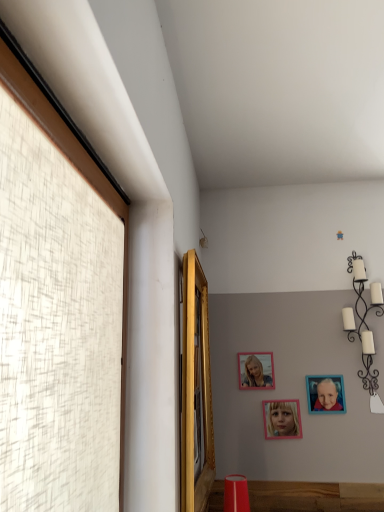
The image size is (384, 512). Find the location of `matte white lampshade at upper center, which ranks as the second lamp in right-to-left order`. matte white lampshade at upper center, which ranks as the second lamp in right-to-left order is located at coordinates (203, 240).

Image resolution: width=384 pixels, height=512 pixels. Describe the element at coordinates (281, 419) in the screenshot. I see `pink matte picture frame at center, acting as the 2th picture frame starting from the left` at that location.

What do you see at coordinates (366, 328) in the screenshot? The height and width of the screenshot is (512, 384). I see `white matte candle holder at upper right, the second lamp from the top` at bounding box center [366, 328].

Find the location of a particular element. matte white lampshade at upper center, arranged as the 1th lamp when viewed from the left is located at coordinates (203, 240).

From the image's perspective, would you say pink matte picture frame at center, arranged as the 2th picture frame when viewed from the right, is positioned over white textured window at left, the first window positioned from the front?

No, from the image's perspective, pink matte picture frame at center, arranged as the 2th picture frame when viewed from the right, is not over white textured window at left, the first window positioned from the front.

Where is `the 2nd window to the left of the pink matte picture frame at center, acting as the 2th picture frame starting from the left, starting your count from the anchor`? the 2nd window to the left of the pink matte picture frame at center, acting as the 2th picture frame starting from the left, starting your count from the anchor is located at coordinates (74, 164).

Is point (270, 404) positioned in front of point (54, 105)?

No, it is not.

Is pink matte picture frame at center, arranged as the 2th picture frame when viewed from the right, not close to white textured window at left, acting as the 2th window starting from the right?

Indeed, pink matte picture frame at center, arranged as the 2th picture frame when viewed from the right, is not near white textured window at left, acting as the 2th window starting from the right.

How different are the orientations of gold wooden mirror at upper left, which is the first window in back-to-front order, and matte white lampshade at upper center, which ranks as the 2th lamp in bottom-to-top order, in degrees?

The angular difference between gold wooden mirror at upper left, which is the first window in back-to-front order, and matte white lampshade at upper center, which ranks as the 2th lamp in bottom-to-top order, is 0.000903 degrees.

Does gold wooden mirror at upper left, which is the first window in back-to-front order, have a larger size compared to matte white lampshade at upper center, the 1th lamp when ordered from back to front?

Indeed, gold wooden mirror at upper left, which is the first window in back-to-front order, has a larger size compared to matte white lampshade at upper center, the 1th lamp when ordered from back to front.

From the image's perspective, is gold wooden mirror at upper left, which is the first window in back-to-front order, located beneath matte white lampshade at upper center, arranged as the 1th lamp when viewed from the left?

Yes, from the image's perspective, gold wooden mirror at upper left, which is the first window in back-to-front order, is below matte white lampshade at upper center, arranged as the 1th lamp when viewed from the left.

From a real-world perspective, is gold wooden mirror at upper left, which is the first window in back-to-front order, positioned above or below matte white lampshade at upper center, the first lamp when ordered from top to bottom?

In terms of real-world spatial position, gold wooden mirror at upper left, which is the first window in back-to-front order, is below matte white lampshade at upper center, the first lamp when ordered from top to bottom.

Is gold wooden mirror at upper left, which is the first window in back-to-front order, not close to white matte candle holder at upper right, acting as the first lamp starting from the right?

Yes, gold wooden mirror at upper left, which is the first window in back-to-front order, and white matte candle holder at upper right, acting as the first lamp starting from the right, are quite far apart.

Between gold wooden mirror at upper left, which is the first window in back-to-front order, and white matte candle holder at upper right, the 2th lamp in the back-to-front sequence, which one is positioned behind?

white matte candle holder at upper right, the 2th lamp in the back-to-front sequence, is more distant.

From a real-world perspective, is gold wooden mirror at upper left, the 2th window positioned from the left, physically located above or below white matte candle holder at upper right, the second lamp from the top?

In terms of real-world spatial position, gold wooden mirror at upper left, the 2th window positioned from the left, is below white matte candle holder at upper right, the second lamp from the top.

Would you say pink matte picture frame at center, acting as the 2th picture frame starting from the left, contains matte white lampshade at upper center, the first lamp when ordered from top to bottom?

No, matte white lampshade at upper center, the first lamp when ordered from top to bottom, is located outside of pink matte picture frame at center, acting as the 2th picture frame starting from the left.

From a real-world perspective, is pink matte picture frame at center, acting as the 2th picture frame starting from the left, on matte white lampshade at upper center, which ranks as the second lamp in right-to-left order?

No, from a real-world perspective, pink matte picture frame at center, acting as the 2th picture frame starting from the left, is not over matte white lampshade at upper center, which ranks as the second lamp in right-to-left order

Is pink matte picture frame at center, acting as the 2th picture frame starting from the left, oriented towards matte white lampshade at upper center, which ranks as the 2th lamp in bottom-to-top order?

No, pink matte picture frame at center, acting as the 2th picture frame starting from the left, is not oriented towards matte white lampshade at upper center, which ranks as the 2th lamp in bottom-to-top order.

From the image's perspective, starting from the white matte candle holder at upper right, which is the 1th lamp from bottom to top, which picture frame is the 1st one below? Please provide its 2D coordinates.

[(256, 371)]

Is white matte candle holder at upper right, the second lamp from the top, far from pink matte picture frame at upper center, the 3th picture frame viewed from the right?

No.

Consider the image. Considering their positions, is white matte candle holder at upper right, the second lamp viewed from the left, located in front of or behind pink matte picture frame at upper center, the 3th picture frame viewed from the right?

white matte candle holder at upper right, the second lamp viewed from the left, is positioned closer to the viewer than pink matte picture frame at upper center, the 3th picture frame viewed from the right.

Is pink matte picture frame at upper center, which is counted as the 1th picture frame, starting from the left, located within white matte candle holder at upper right, which is the 1th lamp from bottom to top?

No.

Consider the image. Is pink matte picture frame at center, acting as the 2th picture frame starting from the left, positioned beyond the bounds of pink matte picture frame at upper center, which is counted as the 1th picture frame, starting from the left?

Yes, pink matte picture frame at center, acting as the 2th picture frame starting from the left, is outside of pink matte picture frame at upper center, which is counted as the 1th picture frame, starting from the left.

From a real-world perspective, relative to pink matte picture frame at upper center, the 3th picture frame viewed from the right, is pink matte picture frame at center, arranged as the 2th picture frame when viewed from the right, vertically above or below?

In terms of real-world spatial position, pink matte picture frame at center, arranged as the 2th picture frame when viewed from the right, is below pink matte picture frame at upper center, the 3th picture frame viewed from the right.

Could you tell me if pink matte picture frame at center, acting as the 2th picture frame starting from the left, is turned towards pink matte picture frame at upper center, the 3th picture frame viewed from the right?

No, pink matte picture frame at center, acting as the 2th picture frame starting from the left, does not turn towards pink matte picture frame at upper center, the 3th picture frame viewed from the right.

Based on the photo, considering the relative sizes of pink matte picture frame at center, acting as the 2th picture frame starting from the left, and pink matte picture frame at upper center, which is counted as the 1th picture frame, starting from the left, in the image provided, is pink matte picture frame at center, acting as the 2th picture frame starting from the left, smaller than pink matte picture frame at upper center, which is counted as the 1th picture frame, starting from the left,?

Yes, pink matte picture frame at center, acting as the 2th picture frame starting from the left, is smaller than pink matte picture frame at upper center, which is counted as the 1th picture frame, starting from the left.

Is white textured window at left, marked as the 1th window in a left-to-right arrangement, oriented towards gold wooden mirror at upper left, which is the first window in back-to-front order?

No, white textured window at left, marked as the 1th window in a left-to-right arrangement, is not turned towards gold wooden mirror at upper left, which is the first window in back-to-front order.

How far apart are white textured window at left, marked as the 1th window in a left-to-right arrangement, and gold wooden mirror at upper left, the 2th window positioned from the left?

white textured window at left, marked as the 1th window in a left-to-right arrangement, and gold wooden mirror at upper left, the 2th window positioned from the left, are 16.38 inches apart from each other.

Does white textured window at left, the 2th window from the back, touch gold wooden mirror at upper left, which is the first window in back-to-front order?

No, white textured window at left, the 2th window from the back, is not with gold wooden mirror at upper left, which is the first window in back-to-front order.

Is white textured window at left, the first window positioned from the front, taller or shorter than gold wooden mirror at upper left, which is the first window in back-to-front order?

Clearly, white textured window at left, the first window positioned from the front, is taller compared to gold wooden mirror at upper left, which is the first window in back-to-front order.

Locate an element on the screen. Image resolution: width=384 pixels, height=512 pixels. the 2nd window positioned above the pink matte picture frame at center, acting as the 2th picture frame starting from the left (from the image's perspective) is located at coordinates (74, 164).

At what (x,y) coordinates should I click in order to perform the action: click on lamp that is the 2nd object located behind the gold wooden mirror at upper left, the 2th window positioned from the left. Please return your answer as a coordinate pair (x, y). Image resolution: width=384 pixels, height=512 pixels. Looking at the image, I should click on (203, 240).

From the image, which object appears to be nearer to blue matte picture frame at upper right, marked as the 1th picture frame in a right-to-left arrangement, white textured window at left, the first window positioned from the front, or white matte candle holder at upper right, the 1th lamp when ordered from front to back?

The object closer to blue matte picture frame at upper right, marked as the 1th picture frame in a right-to-left arrangement, is white matte candle holder at upper right, the 1th lamp when ordered from front to back.

Considering their positions, is matte white lampshade at upper center, the first lamp when ordered from top to bottom, positioned closer to pink matte picture frame at upper center, which is counted as the 1th picture frame, starting from the left, than white textured window at left, the 2th window from the back?

Among the two, matte white lampshade at upper center, the first lamp when ordered from top to bottom, is located nearer to pink matte picture frame at upper center, which is counted as the 1th picture frame, starting from the left.

From the image, which object appears to be nearer to gold wooden mirror at upper left, which ranks as the first window in right-to-left order, white textured window at left, acting as the 2th window starting from the right, or white matte candle holder at upper right, the second lamp viewed from the left?

Among the two, white textured window at left, acting as the 2th window starting from the right, is located nearer to gold wooden mirror at upper left, which ranks as the first window in right-to-left order.

Considering their positions, is pink matte picture frame at center, acting as the 2th picture frame starting from the left, positioned closer to blue matte picture frame at upper right, the 3th picture frame from the left, than pink matte picture frame at upper center, the 3th picture frame viewed from the right?

pink matte picture frame at center, acting as the 2th picture frame starting from the left.

Estimate the real-world distances between objects in this image. Which object is further from white matte candle holder at upper right, the 1th lamp when ordered from front to back, pink matte picture frame at upper center, which is counted as the 1th picture frame, starting from the left, or gold wooden mirror at upper left, the 2th window positioned from the left?

gold wooden mirror at upper left, the 2th window positioned from the left.

Based on their spatial positions, is white matte candle holder at upper right, the second lamp from the top, or pink matte picture frame at center, acting as the 2th picture frame starting from the left, further from pink matte picture frame at upper center, the 3th picture frame viewed from the right?

white matte candle holder at upper right, the second lamp from the top.

From the image, which object appears to be farther from matte white lampshade at upper center, the 2th lamp positioned from the front, white matte candle holder at upper right, the second lamp viewed from the left, or white textured window at left, the first window positioned from the front?

white textured window at left, the first window positioned from the front, lies further to matte white lampshade at upper center, the 2th lamp positioned from the front, than the other object.

When comparing their distances from white textured window at left, marked as the 1th window in a left-to-right arrangement, does white matte candle holder at upper right, the second lamp from the top, or blue matte picture frame at upper right, the 3th picture frame from the left, seem further?

white matte candle holder at upper right, the second lamp from the top, is further to white textured window at left, marked as the 1th window in a left-to-right arrangement.

At what (x,y) coordinates should I click in order to perform the action: click on lamp between white textured window at left, marked as the 1th window in a left-to-right arrangement, and blue matte picture frame at upper right, the 3th picture frame from the left, in the front-back direction. Please return your answer as a coordinate pair (x, y). This screenshot has width=384, height=512. Looking at the image, I should click on (366, 328).

Identify the location of picture frame between pink matte picture frame at upper center, which is counted as the 1th picture frame, starting from the left, and blue matte picture frame at upper right, the 3th picture frame from the left, from left to right. The width and height of the screenshot is (384, 512). (281, 419).

Identify the location of lamp between white textured window at left, the first window positioned from the front, and pink matte picture frame at upper center, the 3th picture frame viewed from the right, in the front-back direction. This screenshot has width=384, height=512. (366, 328).

Identify the location of window located between white textured window at left, marked as the 1th window in a left-to-right arrangement, and white matte candle holder at upper right, the second lamp from the top, in the depth direction. The image size is (384, 512). (196, 390).